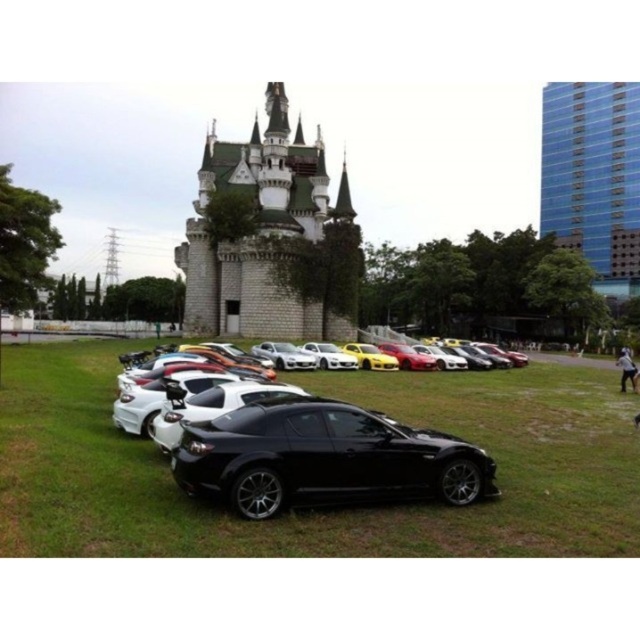
The height and width of the screenshot is (640, 640). Describe the element at coordinates (272, 237) in the screenshot. I see `green stone castle at center` at that location.

Can you confirm if green stone castle at center is shorter than white glossy sports car at center?

No, green stone castle at center is not shorter than white glossy sports car at center.

Describe the element at coordinates (272, 237) in the screenshot. The height and width of the screenshot is (640, 640). I see `green stone castle at center` at that location.

The height and width of the screenshot is (640, 640). Identify the location of green stone castle at center. (272, 237).

Between green stone castle at center and black matte/solid car at center, which one appears on the left side from the viewer's perspective?

From the viewer's perspective, green stone castle at center appears more on the left side.

Does green stone castle at center have a lesser width compared to black matte/solid car at center?

In fact, green stone castle at center might be wider than black matte/solid car at center.

Is point (212, 292) behind point (323, 490)?

That is True.

At what (x,y) coordinates should I click in order to perform the action: click on green stone castle at center. Please return your answer as a coordinate pair (x, y). Looking at the image, I should click on (272, 237).

The height and width of the screenshot is (640, 640). Identify the location of black matte/solid car at center. (321, 456).

Does black matte/solid car at center appear on the right side of white glossy sports car at center?

Correct, you'll find black matte/solid car at center to the right of white glossy sports car at center.

Between point (275, 412) and point (342, 369), which one is positioned behind?

The point (342, 369) is behind.

Where is `black matte/solid car at center`? black matte/solid car at center is located at coordinates (321, 456).